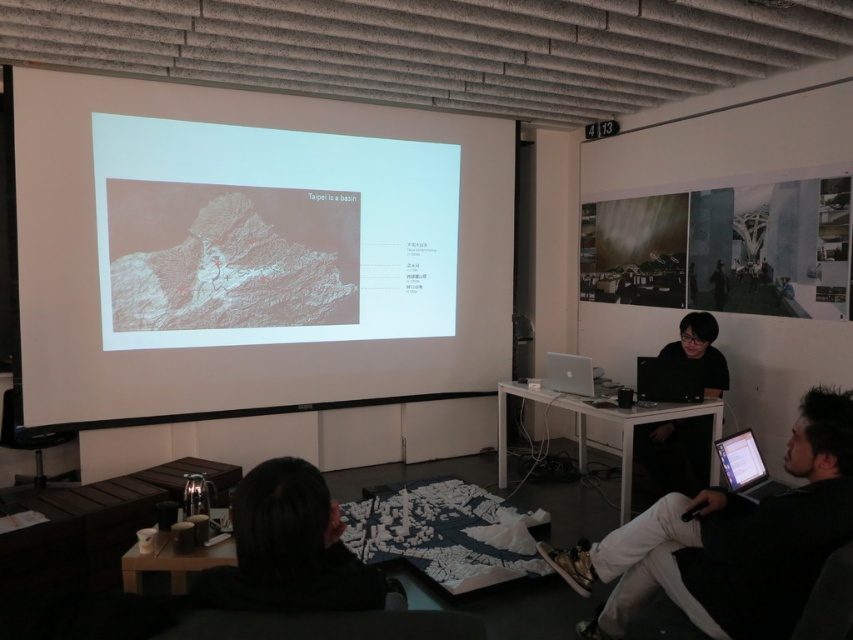
Question: Does white matte projection screen at upper left appear on the left side of black matte shirt at center?

Choices:
 (A) yes
 (B) no

Answer: (A)

Question: Which is nearer to the black matte laptop at center?

Choices:
 (A) silver metallic laptop at lower right
 (B) silver metallic laptop at center
 (C) black fabric at lower center
 (D) white matte projection screen at upper left

Answer: (B)

Question: Which of these objects is positioned farthest from the silver metallic laptop at lower right?

Choices:
 (A) black matte shirt at center
 (B) black matte laptop at center
 (C) matte glass photo at upper right

Answer: (C)

Question: Is black fabric at lower center closer to camera compared to silver metallic laptop at center?

Choices:
 (A) no
 (B) yes

Answer: (B)

Question: Which is nearer to the silver metallic laptop at lower right?

Choices:
 (A) black fabric at lower center
 (B) black fabric chair at lower right
 (C) white matte projection screen at upper left

Answer: (B)

Question: Can you confirm if black fabric chair at lower right is smaller than black matte laptop at center?

Choices:
 (A) yes
 (B) no

Answer: (B)